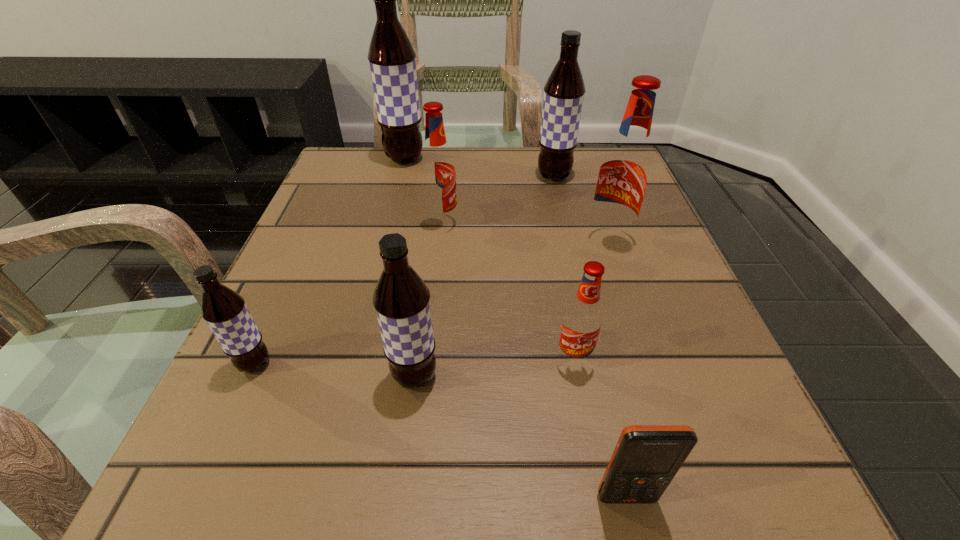
Locate an element on the screen. This screenshot has width=960, height=540. the sixth closest object to the tallest root beer is located at coordinates (582, 321).

Identify which root beer is the third closest to the leftmost root beer. Please provide its 2D coordinates. Your answer should be formatted as a tuple, i.e. [(x, y)], where the tuple contains the x and y coordinates of a point satisfying the conditions above.

[(582, 321)]

Image resolution: width=960 pixels, height=540 pixels. I want to click on the fifth closest root beer to the nearest red root beer, so click(x=564, y=91).

Select which brown root beer appears as the closest to the second smallest brown root beer. Please provide its 2D coordinates. Your answer should be formatted as a tuple, i.e. [(x, y)], where the tuple contains the x and y coordinates of a point satisfying the conditions above.

[(224, 310)]

Image resolution: width=960 pixels, height=540 pixels. I want to click on brown root beer that is the third nearest to the second smallest brown root beer, so click(x=391, y=56).

Locate an element on the screen. The width and height of the screenshot is (960, 540). red root beer object that ranks as the second closest to the third brown root beer from left to right is located at coordinates (437, 170).

Locate which red root beer is the third closest to the leftmost root beer. Please provide its 2D coordinates. Your answer should be formatted as a tuple, i.e. [(x, y)], where the tuple contains the x and y coordinates of a point satisfying the conditions above.

[(623, 177)]

The image size is (960, 540). Identify the location of free space that satisfies the following two spatial constraints: 1. on the back side of the smallest brown root beer; 2. on the right side of the tallest object. (348, 159).